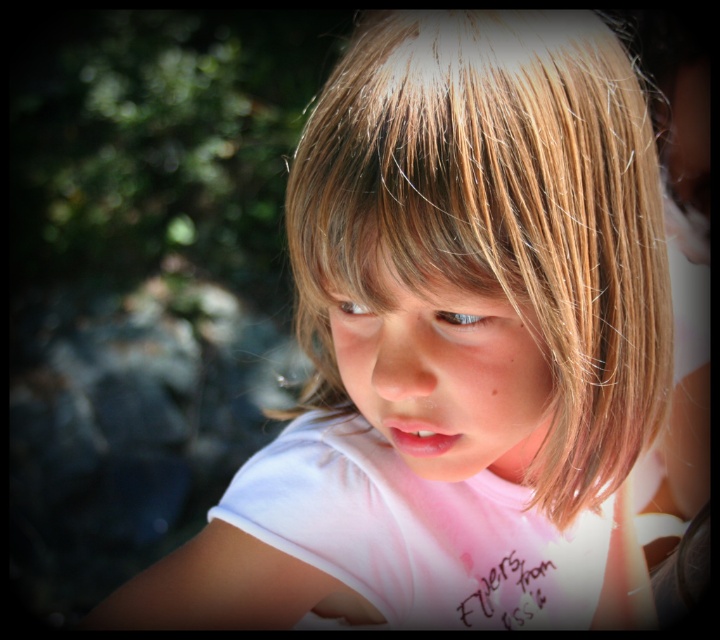
Is blue glossy eye at center thinner than brown matte eye at center?

No.

Which is behind, point (480, 323) or point (341, 298)?

The point (341, 298) is behind.

Which is in front, point (472, 323) or point (354, 317)?

Point (472, 323)

Where is `blue glossy eye at center`? blue glossy eye at center is located at coordinates (462, 317).

Does smooth skin face at center have a smaller size compared to blue glossy eye at center?

No.

Locate an element on the screen. smooth skin face at center is located at coordinates point(445,376).

Who is more forward, [472,392] or [338,310]?

Point [472,392] is in front.

Who is taller, smooth skin face at center or brown matte eye at center?

smooth skin face at center

Find the location of a particular element. Image resolution: width=720 pixels, height=640 pixels. smooth skin face at center is located at coordinates (445, 376).